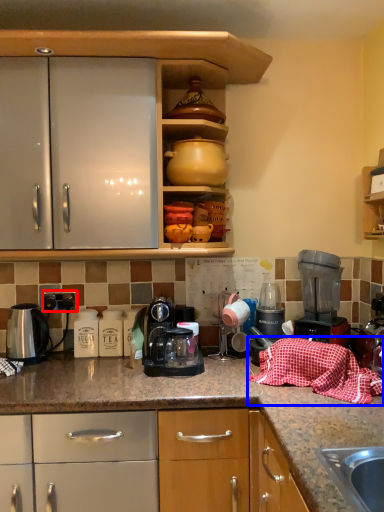
Question: Which of the following is the closest to the observer, electric outlet (highlighted by a red box) or blanket (highlighted by a blue box)?

Choices:
 (A) electric outlet
 (B) blanket

Answer: (B)